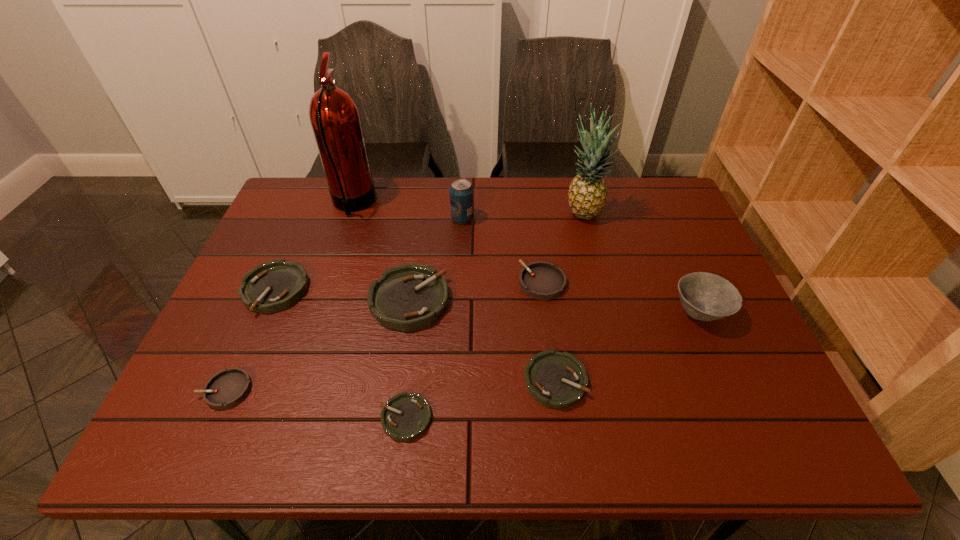
This screenshot has height=540, width=960. I want to click on the leftmost green ashtray, so click(x=276, y=285).

Where is `the smaller gray ashtray`? Image resolution: width=960 pixels, height=540 pixels. the smaller gray ashtray is located at coordinates (227, 388).

Locate an element on the screen. the left gray ashtray is located at coordinates (227, 388).

Where is `the rightmost green ashtray`? This screenshot has width=960, height=540. the rightmost green ashtray is located at coordinates (554, 379).

Locate an element on the screen. Image resolution: width=960 pixels, height=540 pixels. the shortest ashtray is located at coordinates (406, 416).

The image size is (960, 540). Identify the location of the shortest object. (406, 416).

Where is `vacant region located on the front-facing side of the fire extinguisher`? Image resolution: width=960 pixels, height=540 pixels. vacant region located on the front-facing side of the fire extinguisher is located at coordinates (475, 204).

You are a GUI agent. You are given a task and a screenshot of the screen. Output one action in this format:
    pyautogui.click(x=<x>, y=<y>)
    Task: Click on the vacant area situated on the front of the yellow pineapple
    The height and width of the screenshot is (540, 960).
    Given the screenshot: What is the action you would take?
    pyautogui.click(x=605, y=298)

Find the location of a particular element. vacant space situated on the left of the pop soda is located at coordinates (415, 218).

Where is `free space located 0.100m on the back of the bowl`? Image resolution: width=960 pixels, height=540 pixels. free space located 0.100m on the back of the bowl is located at coordinates (678, 264).